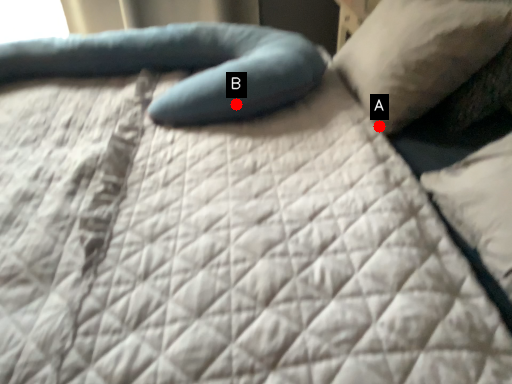
Question: Two points are circled on the image, labeled by A and B beside each circle. Which point is closer to the camera?

Choices:
 (A) A is closer
 (B) B is closer

Answer: (B)